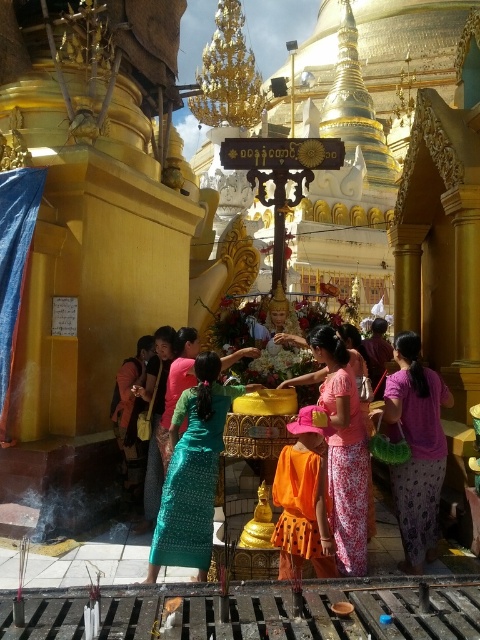
You are standing at point (419, 508). There is a golden shrine 28.96 meters away from you. Can you see the golden shrine from your current position?

Yes, because the golden shrine is 28.96 meters away from you at point (419, 508), so you can see it.

You are a photographer standing at the entrance of the temple. You want to capture a photo that includes both the pink fabric skirt at lower right and the green silk dress at center. Since you want the pink fabric skirt to appear larger in the photo, where should you position yourself relative to the two objects?

The pink fabric skirt at lower right is taller than the green silk dress at center. To make the pink fabric skirt appear larger in the photo, you should position yourself closer to the pink fabric skirt at lower right.

You are a photographer standing in front of the temple altar. You want to take a photo that includes both the pink printed fabric at center and the green silk dress at center. Which one should you adjust your camera angle to focus on first to ensure both are in the frame?

The pink printed fabric at center is in front of the green silk dress at center, so you should focus on the green silk dress at center first to ensure both are visible in the frame.